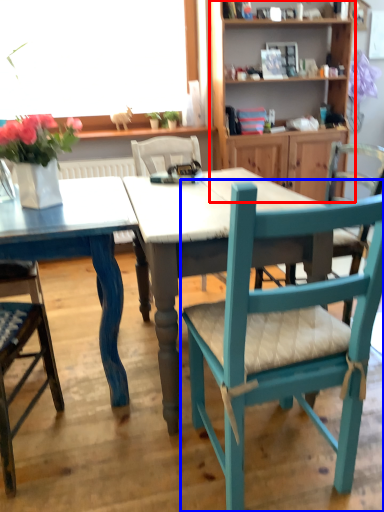
Question: Which of the following is the farthest to the observer, shelf (highlighted by a red box) or chair (highlighted by a blue box)?

Choices:
 (A) shelf
 (B) chair

Answer: (A)